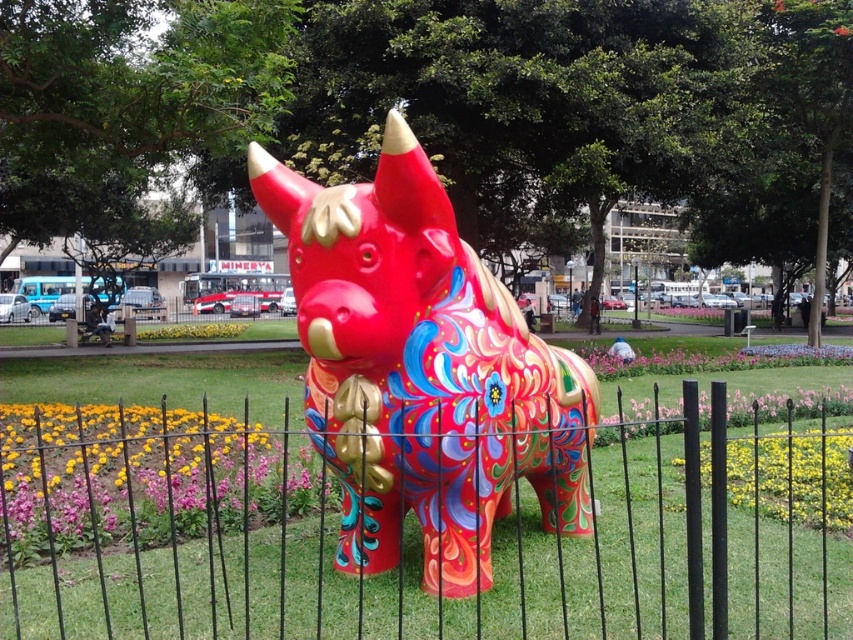
Question: Based on their relative distances, which object is nearer to the black metal fence at center?

Choices:
 (A) shiny plastic bull at center
 (B) yellow matte flower at center

Answer: (A)

Question: Is shiny plastic bull at center to the right of yellow matte flower at center from the viewer's perspective?

Choices:
 (A) no
 (B) yes

Answer: (A)

Question: Which of the following is the farthest from the observer?

Choices:
 (A) (477, 499)
 (B) (161, 502)
 (C) (142, 605)
 (D) (792, 513)

Answer: (B)

Question: Considering the relative positions of purple matte flower at center and yellow matte flower at center in the image provided, where is purple matte flower at center located with respect to yellow matte flower at center?

Choices:
 (A) right
 (B) left

Answer: (B)

Question: Which of the following is the closest to the observer?

Choices:
 (A) (412, 195)
 (B) (403, 470)

Answer: (A)

Question: Does black metal fence at center appear under purple matte flower at center?

Choices:
 (A) no
 (B) yes

Answer: (B)